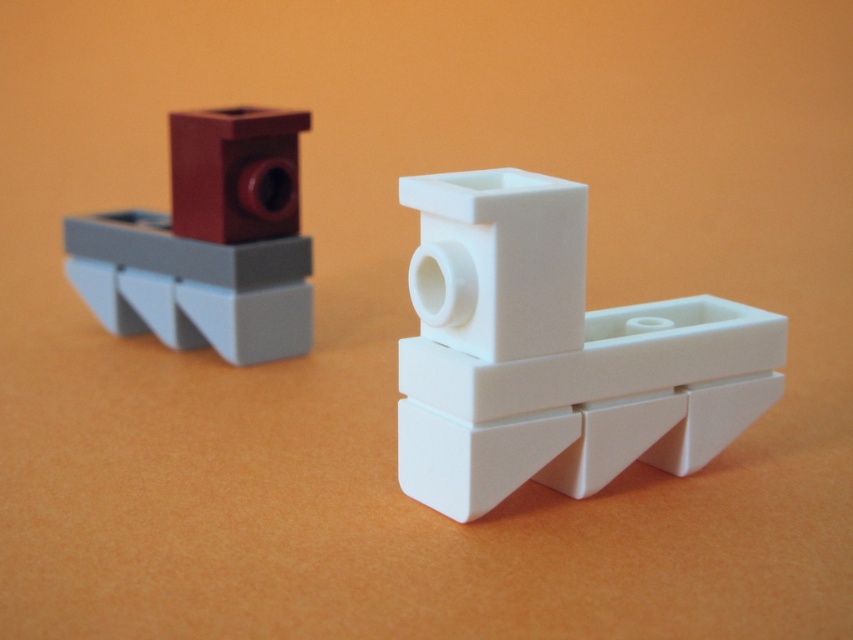
You are a child trying to reach both the white plastic boat at center and the matte red brick at upper left. Which object can you grab first without moving your hand?

The white plastic boat at center is closer to the viewer than the matte red brick at upper left, so you can grab it first without moving your hand.

You are playing with LEGO boats and want to place a new boat between the gray and red LEGO boat on the left and the white plastic boat at center. Can you determine if there is enough space between them based on their positions?

The white plastic boat at center is located at point (x=555, y=353), so there is enough space between the gray and red LEGO boat on the left and the white plastic boat at center to place a new boat between them.